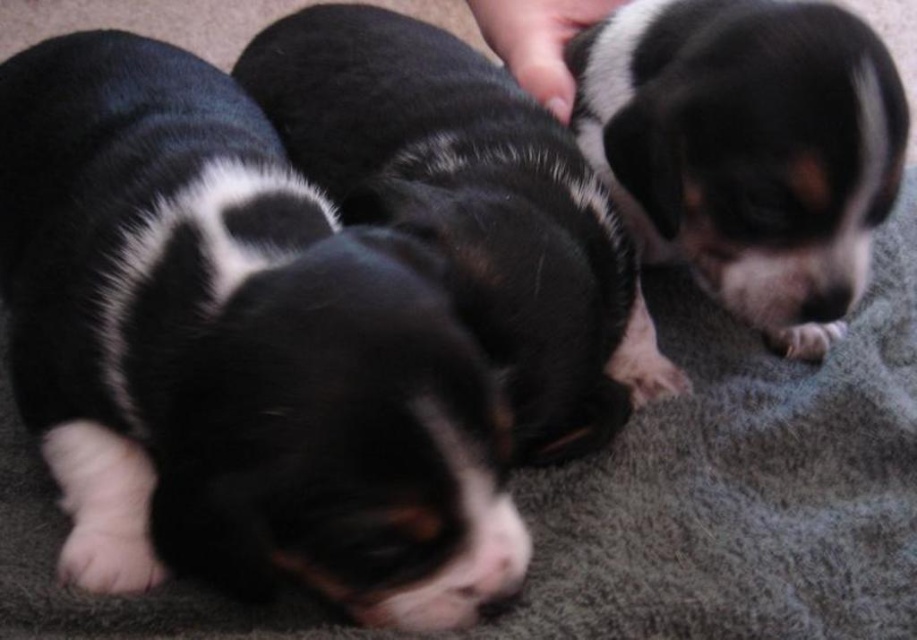
Question: Which of the following is the farthest from the observer?

Choices:
 (A) black soft fur puppies at center
 (B) black fur puppy at center

Answer: (A)

Question: Does black fur puppy at center have a smaller size compared to soft gray carpet at center?

Choices:
 (A) no
 (B) yes

Answer: (B)

Question: Can you confirm if black fur puppy at center is thinner than black soft fur puppies at center?

Choices:
 (A) yes
 (B) no

Answer: (B)

Question: Which of these objects is positioned farthest from the black fur puppy at center?

Choices:
 (A) soft gray carpet at center
 (B) black soft fur puppies at center
 (C) black and white fur at center

Answer: (C)

Question: Which of these objects is positioned closest to the black fur puppy at center?

Choices:
 (A) black soft fur puppies at center
 (B) black and white fur at center
 (C) soft gray carpet at center

Answer: (A)

Question: Does black fur puppy at center appear over black soft fur puppies at center?

Choices:
 (A) yes
 (B) no

Answer: (B)